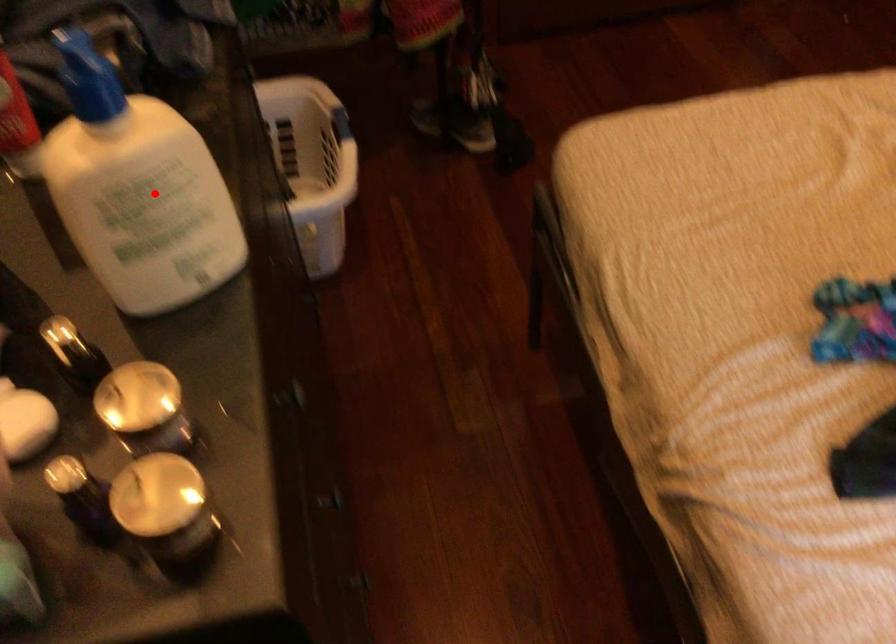
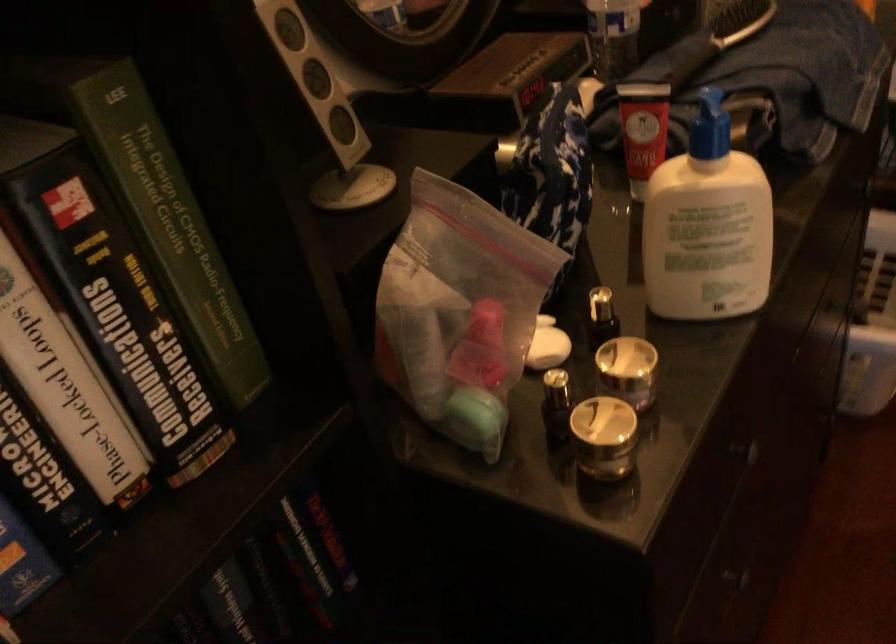
Locate, in the second image, the point that corresponds to the highlighted location in the first image.

(707, 225)